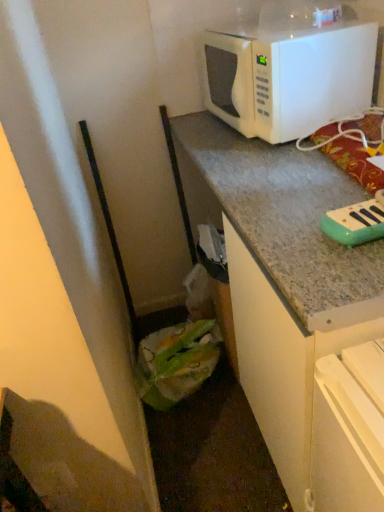
Where is `teal plastic toy piano at upper right`? The height and width of the screenshot is (512, 384). teal plastic toy piano at upper right is located at coordinates (356, 222).

At what (x,y) coordinates should I click in order to perform the action: click on white matte microwave at upper right. Please return your answer as a coordinate pair (x, y). This screenshot has width=384, height=512. Looking at the image, I should click on (289, 78).

In the image, is white matte microwave at upper right on the left side or the right side of green plastic bag at lower left?

white matte microwave at upper right is to the right of green plastic bag at lower left.

Is white matte microwave at upper right in contact with green plastic bag at lower left?

No, white matte microwave at upper right is not making contact with green plastic bag at lower left.

The width and height of the screenshot is (384, 512). In the image, there is a white matte microwave at upper right. What are the coordinates of `cabinetry below it (from the image's perspective)` in the screenshot? It's located at (280, 362).

From the image's perspective, is white matte microwave at upper right below green plastic bag at lower left?

Incorrect, from the image's perspective, white matte microwave at upper right is higher than green plastic bag at lower left.

Does teal plastic toy piano at upper right come in front of white matte microwave at upper right?

That is True.

Is point (344, 245) closer or farther from the camera than point (310, 111)?

Point (344, 245) appears to be closer to the viewer than point (310, 111).

Based on the photo, is teal plastic toy piano at upper right inside or outside of white matte microwave at upper right?

The correct answer is: outside.

How different are the orientations of green plastic bag at lower left and teal plastic toy piano at upper right in degrees?

They differ by 85.5 degrees in their facing directions.

From the image's perspective, is green plastic bag at lower left over teal plastic toy piano at upper right?

No, from the image's perspective, green plastic bag at lower left is not over teal plastic toy piano at upper right.

Considering the relative sizes of green plastic bag at lower left and teal plastic toy piano at upper right in the image provided, is green plastic bag at lower left taller than teal plastic toy piano at upper right?

Yes, green plastic bag at lower left is taller than teal plastic toy piano at upper right.

From a real-world perspective, which is physically below, green plastic bag at lower left or teal plastic toy piano at upper right?

green plastic bag at lower left, from a real-world perspective.

Who is bigger, white matte microwave at upper right or teal plastic toy piano at upper right?

white matte microwave at upper right.

From the image's perspective, which object appears higher, white matte microwave at upper right or teal plastic toy piano at upper right?

white matte microwave at upper right, from the image's perspective.

Does white matte microwave at upper right turn towards teal plastic toy piano at upper right?

No.

Who is shorter, white matte microwave at upper right or teal plastic toy piano at upper right?

teal plastic toy piano at upper right is shorter.

From the picture: What's the angular difference between green plastic bag at lower left and white matte microwave at upper right's facing directions?

81.8 degrees.

From a real-world perspective, is green plastic bag at lower left physically below white matte microwave at upper right?

Indeed, from a real-world perspective, green plastic bag at lower left is positioned beneath white matte microwave at upper right.

Does green plastic bag at lower left have a greater width compared to white matte microwave at upper right?

Yes, green plastic bag at lower left is wider than white matte microwave at upper right.

At what (x,y) coordinates should I click in order to perform the action: click on microwave oven above the green plastic bag at lower left (from a real-world perspective). Please return your answer as a coordinate pair (x, y). Image resolution: width=384 pixels, height=512 pixels. Looking at the image, I should click on (289, 78).

From the picture: Which is closer, (381, 234) or (234, 243)?

Positioned in front is point (381, 234).

Is teal plastic toy piano at upper right not near green plastic bag at lower left?

teal plastic toy piano at upper right is near green plastic bag at lower left, not far away.

Based on the photo, is teal plastic toy piano at upper right facing away from green plastic bag at lower left?

No, teal plastic toy piano at upper right's orientation is not away from green plastic bag at lower left.

From the image's perspective, is teal plastic toy piano at upper right above or below green plastic bag at lower left?

Clearly, from the image's perspective, teal plastic toy piano at upper right is above green plastic bag at lower left.

Locate an element on the screen. This screenshot has width=384, height=512. microwave oven that appears above the green plastic bag at lower left (from the image's perspective) is located at coordinates (289, 78).

Locate an element on the screen. The height and width of the screenshot is (512, 384). appliance in front of the white matte microwave at upper right is located at coordinates (356, 222).

From the image, which object appears to be farther from white matte microwave at upper right, teal plastic toy piano at upper right or green plastic bag at lower left?

green plastic bag at lower left is positioned further to the anchor white matte microwave at upper right.

From the image, which object appears to be farther from green plastic bag at lower left, white matte microwave at upper right or teal plastic toy piano at upper right?

white matte microwave at upper right.

From the image, which object appears to be nearer to teal plastic toy piano at upper right, green plastic bag at lower left or white matte microwave at upper right?

green plastic bag at lower left lies closer to teal plastic toy piano at upper right than the other object.

Based on their spatial positions, is green plastic bag at lower left or teal plastic toy piano at upper right closer to white matte microwave at upper right?

The object closer to white matte microwave at upper right is teal plastic toy piano at upper right.

Looking at the image, which one is located closer to teal plastic toy piano at upper right, white matte microwave at upper right or green plastic bag at lower left?

green plastic bag at lower left is closer to teal plastic toy piano at upper right.

Based on their spatial positions, is teal plastic toy piano at upper right or white matte microwave at upper right further from green plastic bag at lower left?

white matte microwave at upper right lies further to green plastic bag at lower left than the other object.

Image resolution: width=384 pixels, height=512 pixels. Identify the location of appliance that lies between white matte microwave at upper right and green plastic bag at lower left from top to bottom. (356, 222).